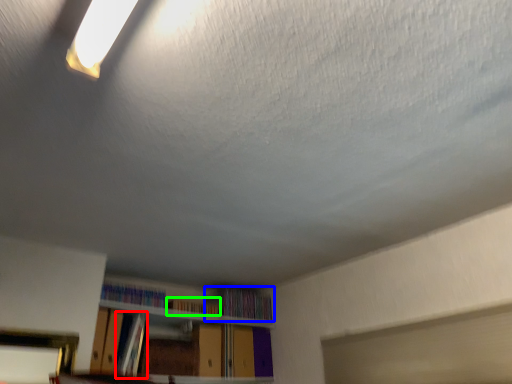
Question: Which object is the closest to the book (highlighted by a red box)? Choose among these: book (highlighted by a blue box) or book (highlighted by a green box).

Choices:
 (A) book
 (B) book

Answer: (B)